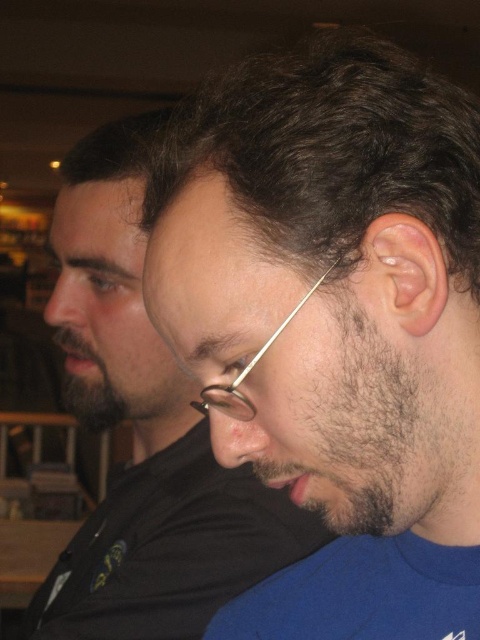
Is dark blue fabric shirt at center shorter than metallic wire-rimmed glasses at center?

Incorrect, dark blue fabric shirt at center's height does not fall short of metallic wire-rimmed glasses at center's.

Which is below, dark blue fabric shirt at center or metallic wire-rimmed glasses at center?

metallic wire-rimmed glasses at center

Where is `dark blue fabric shirt at center`? Image resolution: width=480 pixels, height=640 pixels. dark blue fabric shirt at center is located at coordinates (336, 324).

Does matte black glasses at center have a larger size compared to metallic wire-rimmed glasses at center?

Yes, matte black glasses at center is bigger than metallic wire-rimmed glasses at center.

Does point (166, 115) come in front of point (226, 394)?

No, (166, 115) is behind (226, 394).

The image size is (480, 640). I want to click on matte black glasses at center, so click(x=144, y=433).

Between dark blue fabric shirt at center and matte black glasses at center, which one appears on the left side from the viewer's perspective?

matte black glasses at center

Is point (453, 248) in front of point (94, 160)?

Yes, point (453, 248) is in front of point (94, 160).

I want to click on dark blue fabric shirt at center, so click(336, 324).